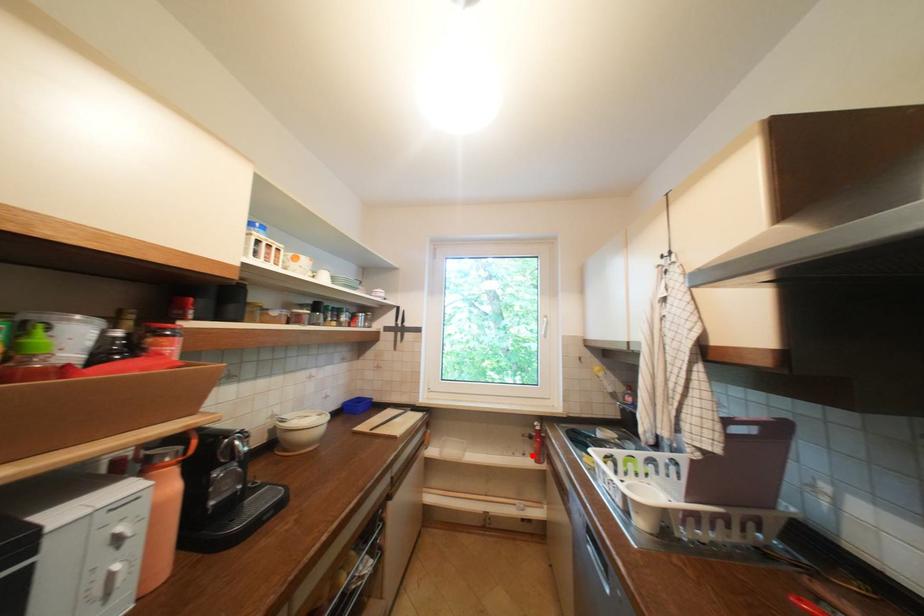
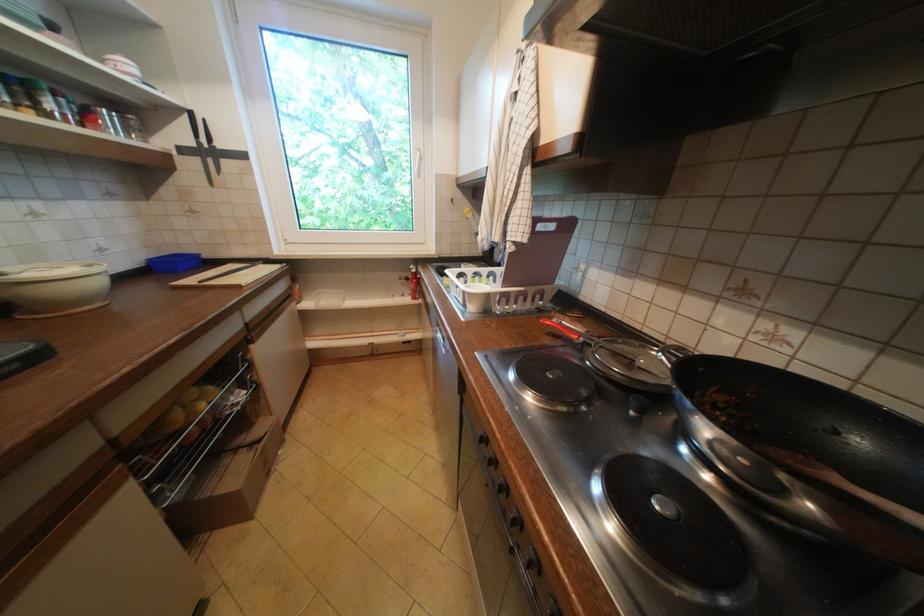
Locate, in the second image, the point that corresponds to the highlighted location in the first image.

(410, 296)